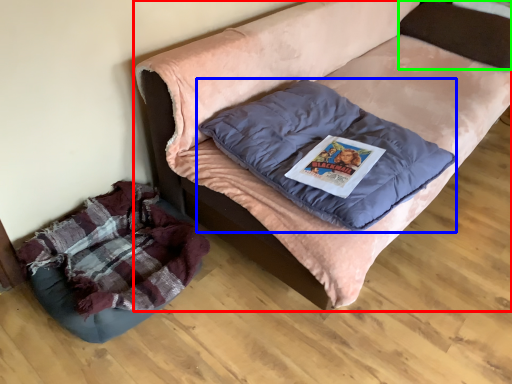
Question: Based on their relative distances, which object is nearer to furniture (highlighted by a red box)? Choose from pillow (highlighted by a blue box) and pillow (highlighted by a green box).

Choices:
 (A) pillow
 (B) pillow

Answer: (A)